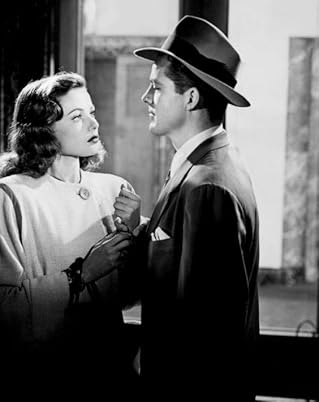
Where is `light gray background color`? Image resolution: width=319 pixels, height=402 pixels. light gray background color is located at coordinates (266, 87).